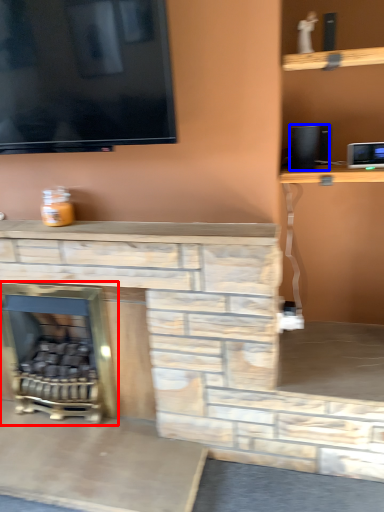
Question: Which of the following is the farthest to the observer, fireplace (highlighted by a red box) or speaker (highlighted by a blue box)?

Choices:
 (A) fireplace
 (B) speaker

Answer: (A)